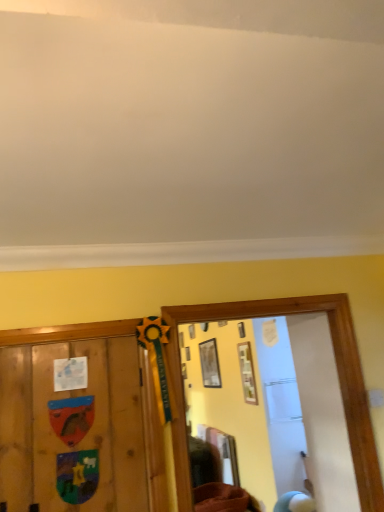
Question: From their relative heights in the image, would you say brown fabric at lower center is taller or shorter than wooden picture frame at upper center, which is counted as the 1th picture frame, starting from the back?

Choices:
 (A) tall
 (B) short

Answer: (B)

Question: Is brown fabric at lower center situated inside wooden picture frame at upper center, the 3th picture frame from the right, or outside?

Choices:
 (A) outside
 (B) inside

Answer: (A)

Question: Which object is positioned closest to the wooden picture frame at upper center, positioned as the 3th picture frame in front-to-back order?

Choices:
 (A) matte wooden picture frame at upper center, which is the second picture frame in right-to-left order
 (B) matte white picture frame at center, arranged as the 1th picture frame when viewed from the right
 (C) brown fabric at lower center

Answer: (B)

Question: Estimate the real-world distances between objects in this image. Which object is farther from the matte white picture frame at center, arranged as the 1th picture frame when viewed from the right?

Choices:
 (A) brown fabric at lower center
 (B) matte wooden picture frame at upper center, positioned as the second picture frame in left-to-right order
 (C) wooden picture frame at upper center, which is counted as the 1th picture frame, starting from the back

Answer: (A)